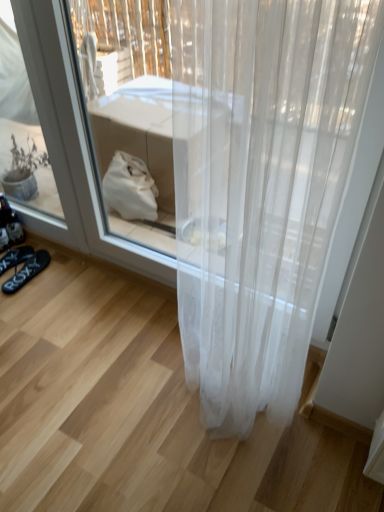
Locate an element on the screen. The width and height of the screenshot is (384, 512). black rubber sandals at lower left, placed as the 1th footwear when sorted from left to right is located at coordinates (15, 257).

Describe the element at coordinates (15, 257) in the screenshot. I see `black rubber sandals at lower left, acting as the second footwear starting from the right` at that location.

In order to face black rubber sandals at lower left, placed as the 1th footwear when sorted from left to right, should I rotate leftwards or rightwards?

You should rotate left by 23.425 degrees.

In order to face black rubber flip-flops at lower left, placed as the 1th footwear when sorted from right to left, should I rotate leftwards or rightwards?

Turn left approximately 21.226 degrees to face it.

What is the approximate height of black rubber flip-flops at lower left, placed as the 1th footwear when sorted from right to left?

black rubber flip-flops at lower left, placed as the 1th footwear when sorted from right to left, is 2.39 inches tall.

Identify the location of black rubber flip-flops at lower left, placed as the 1th footwear when sorted from right to left. The height and width of the screenshot is (512, 384). (27, 271).

What do you see at coordinates (27, 271) in the screenshot? I see `black rubber flip-flops at lower left, arranged as the 2th footwear when viewed from the left` at bounding box center [27, 271].

Where is `black rubber sandals at lower left, acting as the second footwear starting from the right`? This screenshot has width=384, height=512. black rubber sandals at lower left, acting as the second footwear starting from the right is located at coordinates (15, 257).

Which object is positioned more to the right, black rubber flip-flops at lower left, placed as the 1th footwear when sorted from right to left, or black rubber sandals at lower left, placed as the 1th footwear when sorted from left to right?

Positioned to the right is black rubber flip-flops at lower left, placed as the 1th footwear when sorted from right to left.

Is black rubber flip-flops at lower left, arranged as the 2th footwear when viewed from the left, behind black rubber sandals at lower left, placed as the 1th footwear when sorted from left to right?

That is False.

Considering the positions of point (33, 272) and point (5, 263), is point (33, 272) closer or farther from the camera than point (5, 263)?

Clearly, point (33, 272) is closer to the camera than point (5, 263).

From the image's perspective, is black rubber flip-flops at lower left, arranged as the 2th footwear when viewed from the left, below black rubber sandals at lower left, placed as the 1th footwear when sorted from left to right?

Correct, black rubber flip-flops at lower left, arranged as the 2th footwear when viewed from the left, appears lower than black rubber sandals at lower left, placed as the 1th footwear when sorted from left to right, in the image.

From a real-world perspective, between black rubber flip-flops at lower left, placed as the 1th footwear when sorted from right to left, and black rubber sandals at lower left, acting as the second footwear starting from the right, who is vertically lower?

In real-world perspective, black rubber flip-flops at lower left, placed as the 1th footwear when sorted from right to left, is lower.

Considering the relative sizes of black rubber flip-flops at lower left, arranged as the 2th footwear when viewed from the left, and black rubber sandals at lower left, placed as the 1th footwear when sorted from left to right, in the image provided, is black rubber flip-flops at lower left, arranged as the 2th footwear when viewed from the left, wider than black rubber sandals at lower left, placed as the 1th footwear when sorted from left to right,?

Incorrect, the width of black rubber flip-flops at lower left, arranged as the 2th footwear when viewed from the left, does not surpass that of black rubber sandals at lower left, placed as the 1th footwear when sorted from left to right.

Which of these two, black rubber flip-flops at lower left, placed as the 1th footwear when sorted from right to left, or black rubber sandals at lower left, placed as the 1th footwear when sorted from left to right, stands taller?

black rubber flip-flops at lower left, placed as the 1th footwear when sorted from right to left.

Considering the sizes of objects black rubber flip-flops at lower left, arranged as the 2th footwear when viewed from the left, and black rubber sandals at lower left, acting as the second footwear starting from the right, in the image provided, who is smaller, black rubber flip-flops at lower left, arranged as the 2th footwear when viewed from the left, or black rubber sandals at lower left, acting as the second footwear starting from the right,?

Smaller between the two is black rubber sandals at lower left, acting as the second footwear starting from the right.

Is black rubber flip-flops at lower left, arranged as the 2th footwear when viewed from the left, not within black rubber sandals at lower left, placed as the 1th footwear when sorted from left to right?

black rubber flip-flops at lower left, arranged as the 2th footwear when viewed from the left, lies outside black rubber sandals at lower left, placed as the 1th footwear when sorted from left to right,'s area.

Based on the photo, are black rubber flip-flops at lower left, placed as the 1th footwear when sorted from right to left, and black rubber sandals at lower left, placed as the 1th footwear when sorted from left to right, located far from each other?

No, black rubber flip-flops at lower left, placed as the 1th footwear when sorted from right to left, is not far from black rubber sandals at lower left, placed as the 1th footwear when sorted from left to right.

Is black rubber flip-flops at lower left, placed as the 1th footwear when sorted from right to left, turned away from black rubber sandals at lower left, placed as the 1th footwear when sorted from left to right?

No.

Locate an element on the screen. footwear behind the black rubber flip-flops at lower left, placed as the 1th footwear when sorted from right to left is located at coordinates (15, 257).

Is black rubber sandals at lower left, acting as the second footwear starting from the right, at the right side of black rubber flip-flops at lower left, placed as the 1th footwear when sorted from right to left?

Incorrect, black rubber sandals at lower left, acting as the second footwear starting from the right, is not on the right side of black rubber flip-flops at lower left, placed as the 1th footwear when sorted from right to left.

Considering their positions, is black rubber sandals at lower left, acting as the second footwear starting from the right, located in front of or behind black rubber flip-flops at lower left, placed as the 1th footwear when sorted from right to left?

black rubber sandals at lower left, acting as the second footwear starting from the right, is behind black rubber flip-flops at lower left, placed as the 1th footwear when sorted from right to left.

Looking at this image, which point is more forward, [4,261] or [22,274]?

The point [22,274] is closer.

From the image's perspective, does black rubber sandals at lower left, acting as the second footwear starting from the right, appear higher than black rubber flip-flops at lower left, placed as the 1th footwear when sorted from right to left?

Yes, from the image's perspective, black rubber sandals at lower left, acting as the second footwear starting from the right, is on top of black rubber flip-flops at lower left, placed as the 1th footwear when sorted from right to left.

From a real-world perspective, is black rubber sandals at lower left, acting as the second footwear starting from the right, physically below black rubber flip-flops at lower left, placed as the 1th footwear when sorted from right to left?

Actually, black rubber sandals at lower left, acting as the second footwear starting from the right, is physically above black rubber flip-flops at lower left, placed as the 1th footwear when sorted from right to left, in the real world.

Considering the relative sizes of black rubber sandals at lower left, placed as the 1th footwear when sorted from left to right, and black rubber flip-flops at lower left, arranged as the 2th footwear when viewed from the left, in the image provided, is black rubber sandals at lower left, placed as the 1th footwear when sorted from left to right, wider than black rubber flip-flops at lower left, arranged as the 2th footwear when viewed from the left,?

Correct, the width of black rubber sandals at lower left, placed as the 1th footwear when sorted from left to right, exceeds that of black rubber flip-flops at lower left, arranged as the 2th footwear when viewed from the left.

Which of these two, black rubber sandals at lower left, placed as the 1th footwear when sorted from left to right, or black rubber flip-flops at lower left, placed as the 1th footwear when sorted from right to left, stands taller?

black rubber flip-flops at lower left, placed as the 1th footwear when sorted from right to left, is taller.

Which of these two, black rubber sandals at lower left, placed as the 1th footwear when sorted from left to right, or black rubber flip-flops at lower left, arranged as the 2th footwear when viewed from the left, is smaller?

With smaller size is black rubber sandals at lower left, placed as the 1th footwear when sorted from left to right.

Looking at this image, is black rubber flip-flops at lower left, placed as the 1th footwear when sorted from right to left, located within black rubber sandals at lower left, acting as the second footwear starting from the right?

That's incorrect, black rubber flip-flops at lower left, placed as the 1th footwear when sorted from right to left, is not inside black rubber sandals at lower left, acting as the second footwear starting from the right.

Is black rubber sandals at lower left, placed as the 1th footwear when sorted from left to right, next to black rubber flip-flops at lower left, arranged as the 2th footwear when viewed from the left?

Indeed, black rubber sandals at lower left, placed as the 1th footwear when sorted from left to right, and black rubber flip-flops at lower left, arranged as the 2th footwear when viewed from the left, are beside each other and touching.

Is black rubber sandals at lower left, placed as the 1th footwear when sorted from left to right, oriented towards black rubber flip-flops at lower left, arranged as the 2th footwear when viewed from the left?

No, black rubber sandals at lower left, placed as the 1th footwear when sorted from left to right, is not facing towards black rubber flip-flops at lower left, arranged as the 2th footwear when viewed from the left.

How many degrees apart are the facing directions of black rubber sandals at lower left, acting as the second footwear starting from the right, and black rubber flip-flops at lower left, placed as the 1th footwear when sorted from right to left?

The angle between the facing direction of black rubber sandals at lower left, acting as the second footwear starting from the right, and the facing direction of black rubber flip-flops at lower left, placed as the 1th footwear when sorted from right to left, is 1.22 degrees.

How distant is black rubber sandals at lower left, acting as the second footwear starting from the right, from black rubber flip-flops at lower left, arranged as the 2th footwear when viewed from the left?

The distance of black rubber sandals at lower left, acting as the second footwear starting from the right, from black rubber flip-flops at lower left, arranged as the 2th footwear when viewed from the left, is 7.59 centimeters.

Where is `footwear located underneath the black rubber sandals at lower left, acting as the second footwear starting from the right (from a real-world perspective)`? footwear located underneath the black rubber sandals at lower left, acting as the second footwear starting from the right (from a real-world perspective) is located at coordinates (27, 271).

Find the location of a particular element. The width and height of the screenshot is (384, 512). footwear on the right side of black rubber sandals at lower left, placed as the 1th footwear when sorted from left to right is located at coordinates (27, 271).

I want to click on footwear that is on the left side of black rubber flip-flops at lower left, placed as the 1th footwear when sorted from right to left, so click(x=15, y=257).